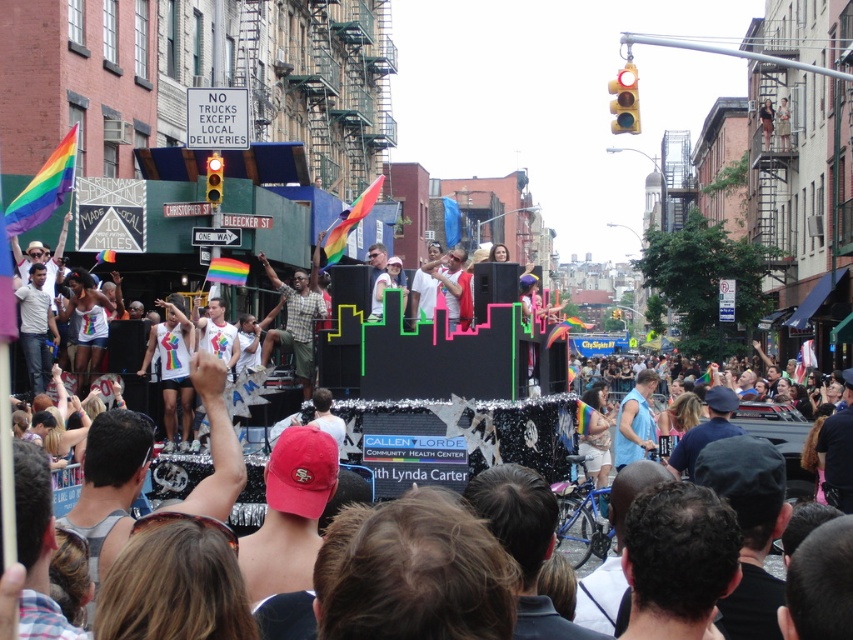
Who is positioned more to the left, checkered fabric shirt at center or neon plastic float at center?

checkered fabric shirt at center

Who is taller, checkered fabric shirt at center or neon plastic float at center?

neon plastic float at center

Measure the distance between point (315, 292) and camera.

Point (315, 292) and camera are 87.54 meters apart from each other.

Where is `checkered fabric shirt at center`? The height and width of the screenshot is (640, 853). checkered fabric shirt at center is located at coordinates (294, 323).